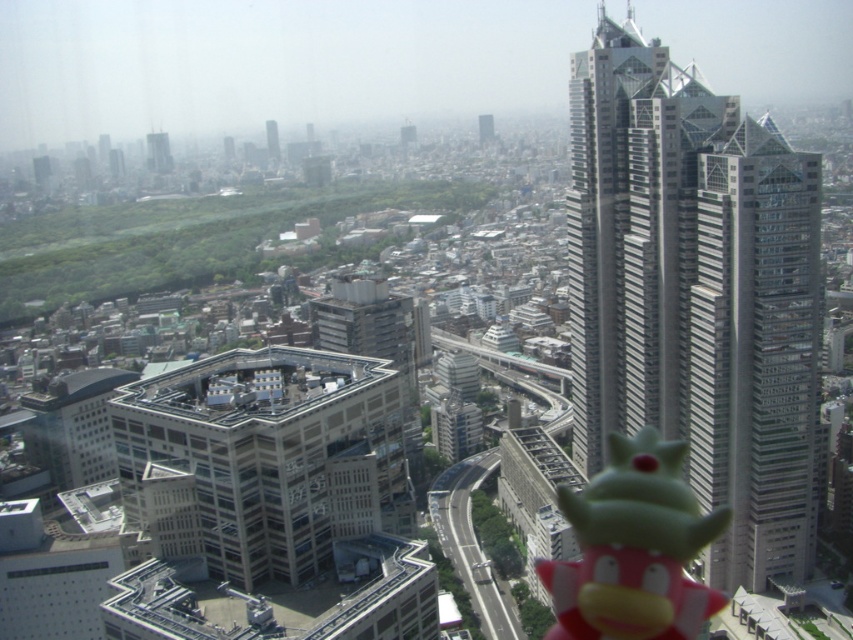
You are standing at the viewpoint of the image and want to determine the relative positions of two points in the urban landscape. Which of the two points, point (120, 451) or point (267, 132), is closer to you?

Point (120, 451) is closer to the viewer than point (267, 132).

You are an urban planner evaluating the skyline of this city. You need to determine which structure is taller between the white concrete building at center and the gray concrete skyscraper at upper center. Based on the provided information, which one is taller?

The gray concrete skyscraper at upper center is taller than the white concrete building at center.

You are a drone operator tasked with flying a drone from the silver glass skyscraper at upper right to the gray concrete skyscraper at upper center. Given that your drone has a maximum range of 450 meters, will it be able to reach its destination without needing to recharge?

The distance between the silver glass skyscraper at upper right and the gray concrete skyscraper at upper center is 449.30 meters, which is just under the drone operator drone maximum range of 450 meters. Therefore, the drone can reach the gray concrete skyscraper at upper center without needing to recharge.